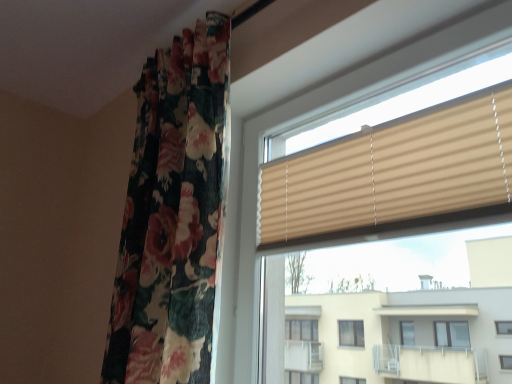
The image size is (512, 384). What are the coordinates of `beige ribbed blinds at center` in the screenshot? It's located at (306, 122).

In order to face beige ribbed blind at upper right, should I rotate leftwards or rightwards?

You should look right and rotate roughly 13.694 degrees.

Find the location of `floral fabric curtain at left`. floral fabric curtain at left is located at coordinates (172, 214).

Identify the location of beige ribbed blinds at center. (306, 122).

I want to click on window blind on the right side of beige ribbed blinds at center, so (394, 174).

Consider the image. Considering the relative sizes of beige ribbed blind at upper right and beige ribbed blinds at center in the image provided, is beige ribbed blind at upper right taller than beige ribbed blinds at center?

In fact, beige ribbed blind at upper right may be shorter than beige ribbed blinds at center.

Considering the positions of objects beige ribbed blind at upper right and beige ribbed blinds at center in the image provided, who is more to the right, beige ribbed blind at upper right or beige ribbed blinds at center?

beige ribbed blind at upper right.

From a real-world perspective, is beige ribbed blinds at center on top of floral fabric curtain at left?

No, from a real-world perspective, beige ribbed blinds at center is not on top of floral fabric curtain at left.

Is beige ribbed blinds at center positioned behind floral fabric curtain at left?

No, it is in front of floral fabric curtain at left.

Which object is thinner, beige ribbed blinds at center or floral fabric curtain at left?

beige ribbed blinds at center is thinner.

Considering the relative sizes of beige ribbed blinds at center and floral fabric curtain at left in the image provided, is beige ribbed blinds at center taller than floral fabric curtain at left?

In fact, beige ribbed blinds at center may be shorter than floral fabric curtain at left.

Based on the photo, which is correct: floral fabric curtain at left is inside beige ribbed blinds at center, or outside of it?

The correct answer is: outside.

Based on the photo, from a real-world perspective, which object stands above the other?

floral fabric curtain at left is physically above.

Is floral fabric curtain at left beside beige ribbed blinds at center?

floral fabric curtain at left is not next to beige ribbed blinds at center, and they're not touching.

Is floral fabric curtain at left aimed at beige ribbed blinds at center?

No, floral fabric curtain at left is not oriented towards beige ribbed blinds at center.

Considering the positions of points (467, 55) and (326, 196), is point (467, 55) farther from camera compared to point (326, 196)?

No, it is not.

Is beige ribbed blinds at center positioned with its back to beige ribbed blind at upper right?

Yes, beige ribbed blind at upper right is at the back of beige ribbed blinds at center.

From a real-world perspective, relative to beige ribbed blind at upper right, is beige ribbed blinds at center vertically above or below?

In terms of real-world spatial position, beige ribbed blinds at center is below beige ribbed blind at upper right.

Is beige ribbed blind at upper right oriented away from floral fabric curtain at left?

No, beige ribbed blind at upper right's orientation is not away from floral fabric curtain at left.

Can you confirm if beige ribbed blind at upper right is smaller than floral fabric curtain at left?

Indeed, beige ribbed blind at upper right has a smaller size compared to floral fabric curtain at left.

How much distance is there between beige ribbed blind at upper right and floral fabric curtain at left?

beige ribbed blind at upper right and floral fabric curtain at left are 40.35 centimeters apart from each other.

Which object is wider, beige ribbed blind at upper right or floral fabric curtain at left?

floral fabric curtain at left.

Considering the relative positions of floral fabric curtain at left and beige ribbed blind at upper right in the image provided, is floral fabric curtain at left behind beige ribbed blind at upper right?

Yes, floral fabric curtain at left is further from the camera.

Looking at this image, is floral fabric curtain at left not near beige ribbed blind at upper right?

floral fabric curtain at left is near beige ribbed blind at upper right, not far away.

Considering the sizes of floral fabric curtain at left and beige ribbed blind at upper right in the image, is floral fabric curtain at left bigger or smaller than beige ribbed blind at upper right?

floral fabric curtain at left is bigger than beige ribbed blind at upper right.

Would you say floral fabric curtain at left contains beige ribbed blind at upper right?

No, beige ribbed blind at upper right is not inside floral fabric curtain at left.

This screenshot has width=512, height=384. Find the location of `window blind above the beige ribbed blinds at center (from a real-world perspective)`. window blind above the beige ribbed blinds at center (from a real-world perspective) is located at coordinates (394, 174).

Locate an element on the screen. The image size is (512, 384). curtain above the beige ribbed blinds at center (from the image's perspective) is located at coordinates coord(172,214).

Consider the image. From the image, which object appears to be nearer to beige ribbed blinds at center, beige ribbed blind at upper right or floral fabric curtain at left?

Based on the image, beige ribbed blind at upper right appears to be nearer to beige ribbed blinds at center.

Considering their positions, is floral fabric curtain at left positioned closer to beige ribbed blinds at center than beige ribbed blind at upper right?

beige ribbed blind at upper right is closer to beige ribbed blinds at center.

Which object lies further to the anchor point floral fabric curtain at left, beige ribbed blind at upper right or beige ribbed blinds at center?

Among the two, beige ribbed blind at upper right is located further to floral fabric curtain at left.

When comparing their distances from floral fabric curtain at left, does beige ribbed blinds at center or beige ribbed blind at upper right seem closer?

beige ribbed blinds at center lies closer to floral fabric curtain at left than the other object.

Looking at the image, which one is located closer to beige ribbed blind at upper right, beige ribbed blinds at center or floral fabric curtain at left?

beige ribbed blinds at center is closer to beige ribbed blind at upper right.

From the image, which object appears to be nearer to beige ribbed blind at upper right, floral fabric curtain at left or beige ribbed blinds at center?

Among the two, beige ribbed blinds at center is located nearer to beige ribbed blind at upper right.

This screenshot has width=512, height=384. Find the location of `window between floral fabric curtain at left and beige ribbed blind at upper right from left to right`. window between floral fabric curtain at left and beige ribbed blind at upper right from left to right is located at coordinates (306, 122).